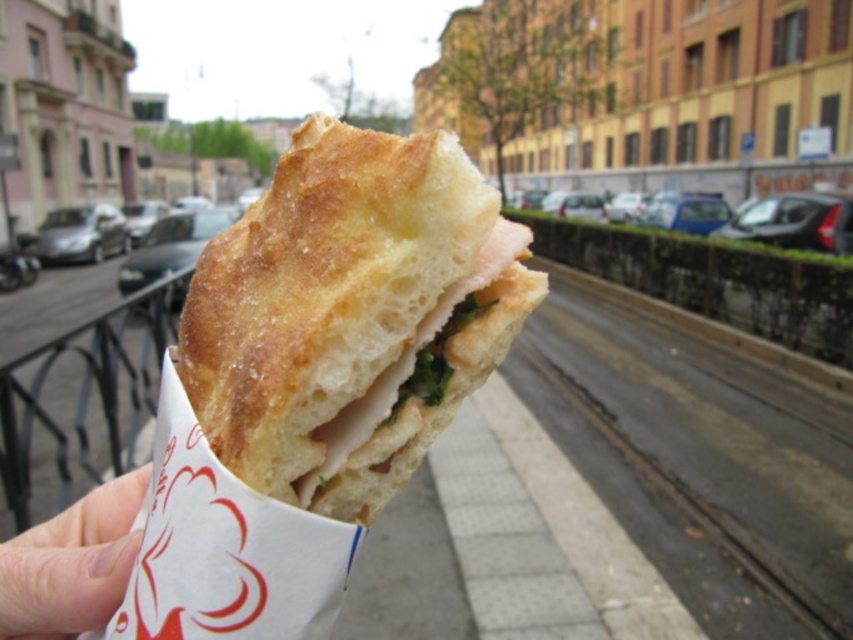
Question: Can you confirm if golden brown crusty bread at center is thinner than dark gray concrete train track at lower center?

Choices:
 (A) no
 (B) yes

Answer: (B)

Question: Where is golden brown crusty bread at center located in relation to pale skin at lower left in the image?

Choices:
 (A) left
 (B) right

Answer: (B)

Question: Which object is closer to the camera taking this photo?

Choices:
 (A) pale skin at lower left
 (B) golden brown crusty bread at center

Answer: (B)

Question: Which object appears farthest from the camera in this image?

Choices:
 (A) dark gray concrete train track at lower center
 (B) pale skin at lower left
 (C) golden brown crusty bread at center

Answer: (A)

Question: Does dark gray concrete train track at lower center appear under pale skin at lower left?

Choices:
 (A) no
 (B) yes

Answer: (B)

Question: Which of the following is the closest to the observer?

Choices:
 (A) pale skin at lower left
 (B) golden brown crusty bread at center

Answer: (B)